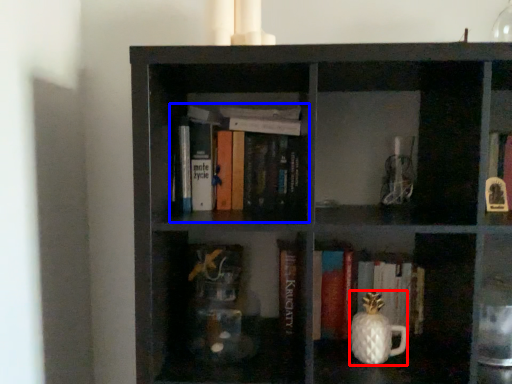
Question: Which object is closer to the camera taking this photo, tea pot (highlighted by a red box) or book (highlighted by a blue box)?

Choices:
 (A) tea pot
 (B) book

Answer: (A)